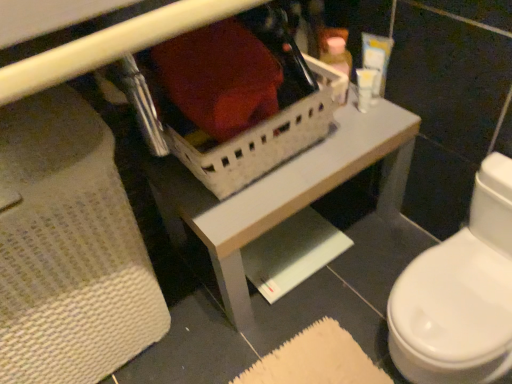
Question: Can you confirm if white plastic basket at center is smaller than white plastic container at upper center, marked as the 1th toiletry in a left-to-right arrangement?

Choices:
 (A) yes
 (B) no

Answer: (B)

Question: Can you confirm if white plastic basket at center is thinner than white plastic container at upper center, positioned as the 3th toiletry in right-to-left order?

Choices:
 (A) no
 (B) yes

Answer: (A)

Question: Is white plastic basket at center shorter than white plastic container at upper center, positioned as the 3th toiletry in right-to-left order?

Choices:
 (A) yes
 (B) no

Answer: (B)

Question: From a real-world perspective, is white plastic basket at center on white plastic container at upper center, positioned as the 3th toiletry in right-to-left order?

Choices:
 (A) no
 (B) yes

Answer: (B)

Question: Is white plastic basket at center with white plastic container at upper center, marked as the 1th toiletry in a left-to-right arrangement?

Choices:
 (A) yes
 (B) no

Answer: (B)

Question: Considering the relative positions of white plastic basket at center and white plastic container at upper center, positioned as the 3th toiletry in right-to-left order, in the image provided, is white plastic basket at center in front of white plastic container at upper center, positioned as the 3th toiletry in right-to-left order,?

Choices:
 (A) yes
 (B) no

Answer: (A)

Question: From a real-world perspective, is white plastic container at upper right, placed as the 1th toiletry when sorted from right to left, on top of white plastic basket at center?

Choices:
 (A) yes
 (B) no

Answer: (B)

Question: Could you tell me if white plastic container at upper right, placed as the 1th toiletry when sorted from right to left, is facing white plastic basket at center?

Choices:
 (A) yes
 (B) no

Answer: (B)

Question: Considering the relative sizes of white plastic container at upper right, placed as the 1th toiletry when sorted from right to left, and white plastic basket at center in the image provided, is white plastic container at upper right, placed as the 1th toiletry when sorted from right to left, taller than white plastic basket at center?

Choices:
 (A) no
 (B) yes

Answer: (A)

Question: Does white plastic container at upper right, placed as the 1th toiletry when sorted from right to left, lie in front of white plastic basket at center?

Choices:
 (A) no
 (B) yes

Answer: (A)

Question: From the image's perspective, is white plastic container at upper right, marked as the third toiletry in a left-to-right arrangement, below white plastic basket at center?

Choices:
 (A) yes
 (B) no

Answer: (B)

Question: From a real-world perspective, is white plastic container at upper right, marked as the third toiletry in a left-to-right arrangement, beneath white plastic basket at center?

Choices:
 (A) yes
 (B) no

Answer: (A)

Question: From a real-world perspective, is white plastic basket at center located beneath white plastic container at upper center, positioned as the 3th toiletry in right-to-left order?

Choices:
 (A) yes
 (B) no

Answer: (A)